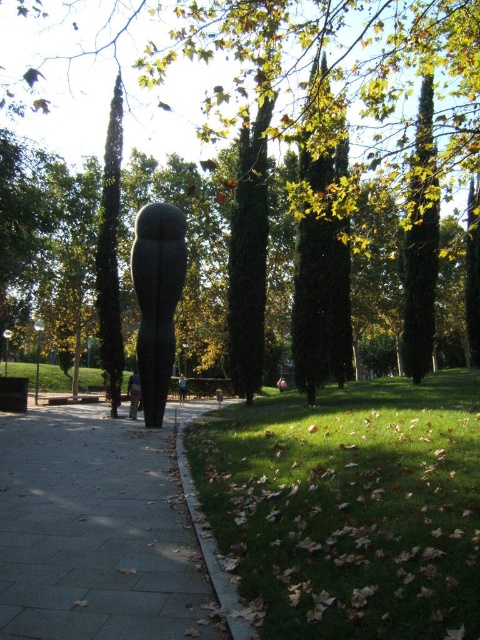
Question: Can you confirm if concrete sidewalk at center is positioned above gray stone sculpture at center?

Choices:
 (A) no
 (B) yes

Answer: (A)

Question: Observing the image, what is the correct spatial positioning of concrete sidewalk at center in reference to light brown wooden pole at center?

Choices:
 (A) left
 (B) right

Answer: (B)

Question: Which point is farther to the camera?

Choices:
 (A) light brown wooden pole at center
 (B) green grass at lower right
 (C) pink fabric person at center
 (D) gray stone sculpture at center

Answer: (C)

Question: Does green grass at lower right appear on the right side of concrete sidewalk at center?

Choices:
 (A) yes
 (B) no

Answer: (A)

Question: Which point is farther to the camera?

Choices:
 (A) green textured tree at center
 (B) concrete sidewalk at center
 (C) light brown wooden pole at center

Answer: (C)

Question: Which of these objects is positioned farthest from the concrete sidewalk at center?

Choices:
 (A) green textured tree at center
 (B) pink fabric person at center
 (C) skinny jeans at center

Answer: (A)